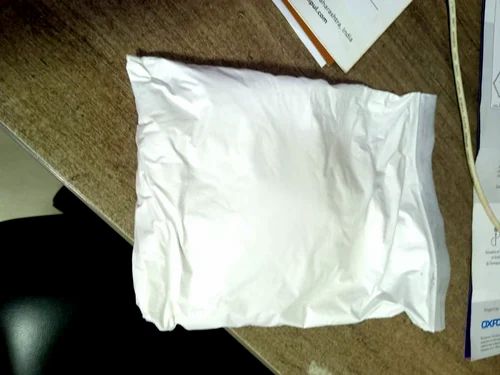
This screenshot has width=500, height=375. In order to click on office chair in this screenshot , I will do `click(87, 297)`.